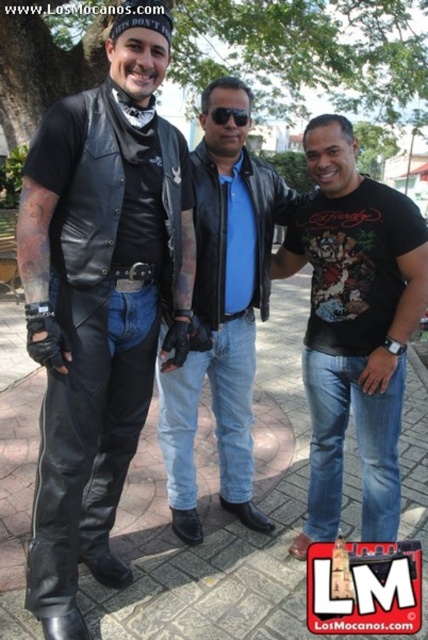
Question: Which of these objects is positioned closest to the black plastic sunglasses at center?

Choices:
 (A) black cotton t-shirt at center
 (B) black leather jacket at center
 (C) matte black leather pants at center

Answer: (B)

Question: Is matte black leather pants at center positioned in front of black leather jacket at center?

Choices:
 (A) yes
 (B) no

Answer: (A)

Question: Which is farther from the black plastic sunglasses at center?

Choices:
 (A) black leather jacket at center
 (B) black cotton t-shirt at center

Answer: (B)

Question: Which object is positioned farthest from the black leather jacket at center?

Choices:
 (A) black cotton t-shirt at center
 (B) matte black leather pants at center

Answer: (B)

Question: Can you confirm if matte black leather pants at center is smaller than black cotton t-shirt at center?

Choices:
 (A) yes
 (B) no

Answer: (A)

Question: Is matte black leather pants at center thinner than black plastic sunglasses at center?

Choices:
 (A) yes
 (B) no

Answer: (B)